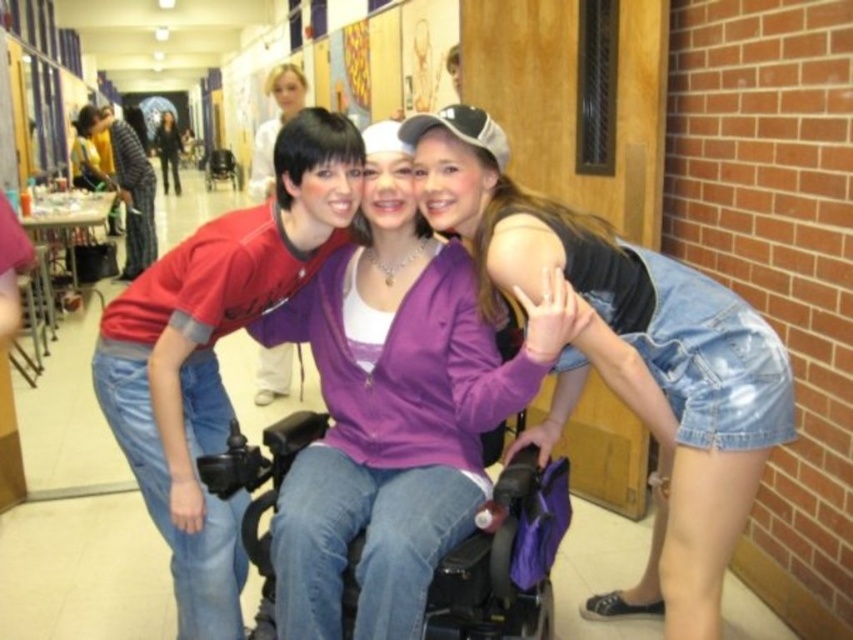
Question: Is purple matte jacket at center wider than matte red shirt at left?

Choices:
 (A) no
 (B) yes

Answer: (B)

Question: Does denim shorts at right appear under matte red shirt at left?

Choices:
 (A) no
 (B) yes

Answer: (B)

Question: Is purple matte jacket at center thinner than denim shorts at right?

Choices:
 (A) no
 (B) yes

Answer: (B)

Question: Based on their relative distances, which object is nearer to the denim shorts at right?

Choices:
 (A) purple matte jacket at center
 (B) black plastic wheelchair at center

Answer: (A)

Question: Based on their relative distances, which object is nearer to the denim shorts at right?

Choices:
 (A) matte red shirt at left
 (B) black plastic wheelchair at center

Answer: (B)

Question: Which of the following is the farthest from the observer?

Choices:
 (A) click(x=199, y=508)
 (B) click(x=453, y=218)
 (C) click(x=399, y=278)

Answer: (C)